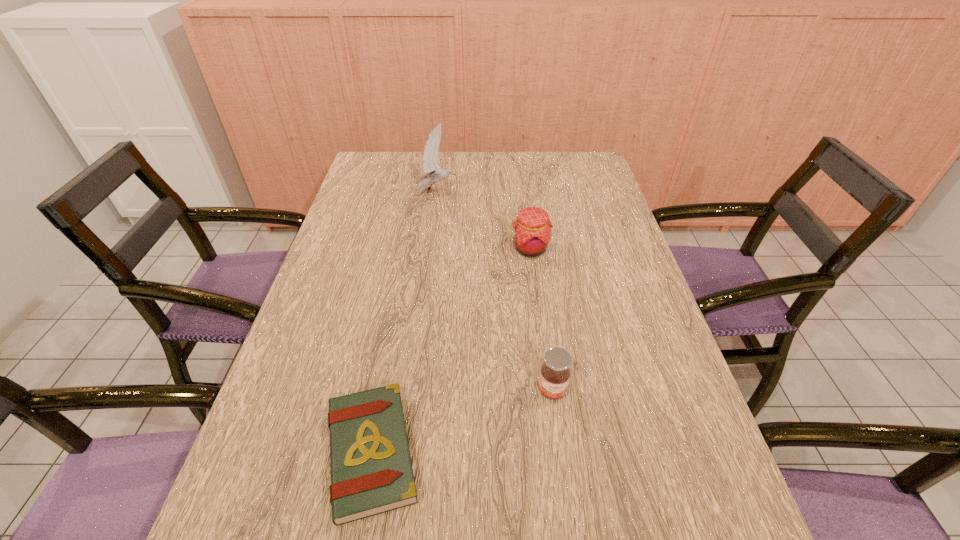
The height and width of the screenshot is (540, 960). Find the location of `object situated at the left edge`. object situated at the left edge is located at coordinates (371, 470).

The width and height of the screenshot is (960, 540). What are the coordinates of `free space at the far edge of the desktop` in the screenshot? It's located at (497, 167).

In the image, there is a desktop. Where is `vacant space at the left edge`? The image size is (960, 540). vacant space at the left edge is located at coordinates (368, 274).

Where is `vacant space at the right edge of the desktop`? This screenshot has height=540, width=960. vacant space at the right edge of the desktop is located at coordinates (638, 476).

Identify the location of blank space at the far left corner of the desktop. The width and height of the screenshot is (960, 540). (400, 163).

This screenshot has width=960, height=540. Identify the location of free space at the far right corner of the desktop. (587, 183).

The height and width of the screenshot is (540, 960). I want to click on vacant space that's between the nearer jam and the farthest object, so click(x=494, y=291).

Locate an element on the screen. The image size is (960, 540). vacant region between the nearer jam and the shortest object is located at coordinates (462, 421).

What are the coordinates of `vacant area between the farthest object and the second farthest object` in the screenshot? It's located at (484, 221).

Locate an element on the screen. This screenshot has height=540, width=960. vacant point located between the third nearest object and the shortest object is located at coordinates (450, 350).